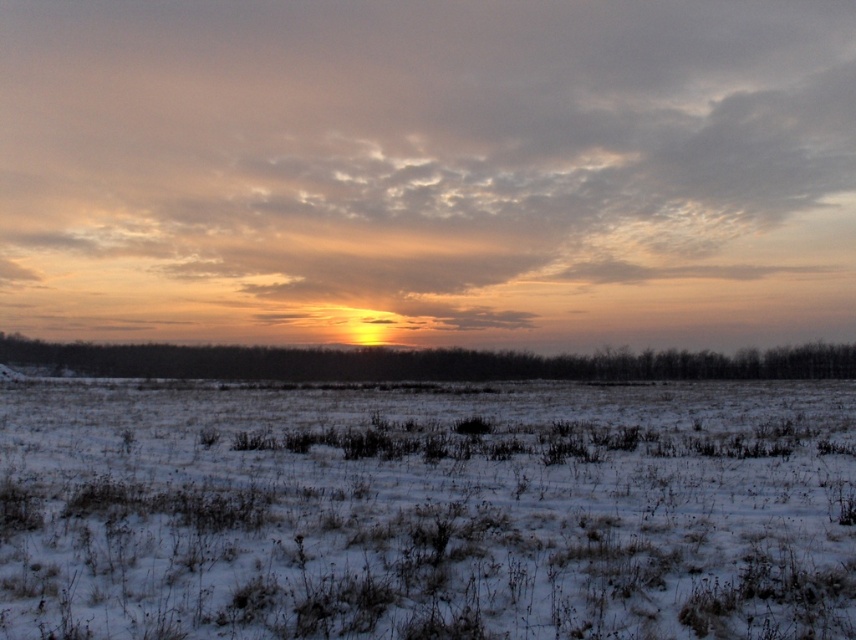
You are standing in the winter landscape and want to walk from the point at coordinates point (57, 96) to the point at coordinates point (6, 456). Which direction should you move to get closer to your destination?

To move closer to the point at coordinates point (6, 456) from point (57, 96), you should move away from the camera since point (57, 96) is closer to the camera than point (6, 456).

You are standing in the winter landscape and want to take a photo of the cloudy sky at center. According to the coordinates provided, where exactly should you aim your camera?

The cloudy sky at center is located at coordinates point (428, 172), so you should aim your camera there.